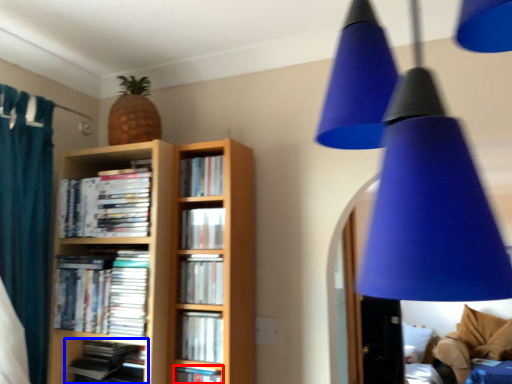
Question: Which object is closer to the camera taking this photo, book (highlighted by a red box) or book (highlighted by a blue box)?

Choices:
 (A) book
 (B) book

Answer: (A)